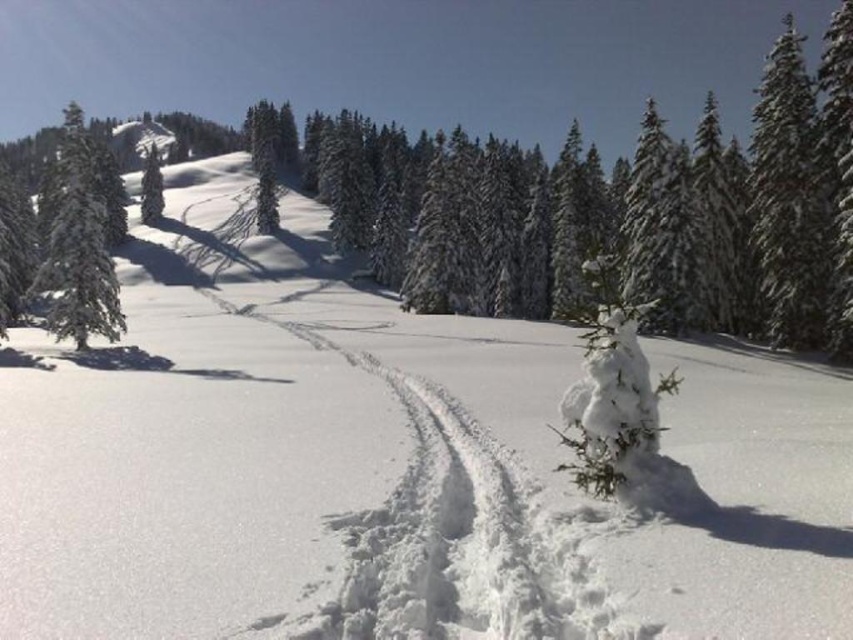
Question: Which point appears farthest from the camera in this image?

Choices:
 (A) (393, 208)
 (B) (94, 204)
 (C) (614, 259)

Answer: (A)

Question: Estimate the real-world distances between objects in this image. Which object is closer to the white fluffy tree at center-right?

Choices:
 (A) green snow-covered tree at left
 (B) snow-covered evergreen tree at upper center

Answer: (B)

Question: Among these points, which one is farthest from the camera?

Choices:
 (A) (73, 163)
 (B) (834, 209)
 (C) (601, 314)

Answer: (A)

Question: Is white fluffy tree at center-right closer to the viewer compared to green snow-covered tree at left?

Choices:
 (A) yes
 (B) no

Answer: (A)

Question: Does white fluffy tree at center-right appear on the right side of green snow-covered tree at left?

Choices:
 (A) no
 (B) yes

Answer: (B)

Question: Is snow-covered evergreen tree at upper center positioned behind green snow-covered tree at left?

Choices:
 (A) no
 (B) yes

Answer: (A)